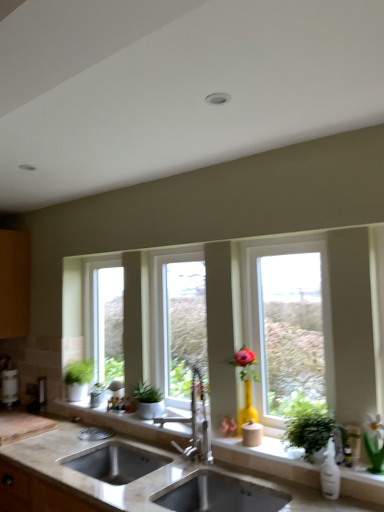
How much space does clear glass window at center, positioned as the 1th window in left-to-right order, occupy vertically?

The height of clear glass window at center, positioned as the 1th window in left-to-right order, is 39.18 inches.

This screenshot has width=384, height=512. What do you see at coordinates (104, 320) in the screenshot?
I see `clear glass window at center, which appears as the 3th window when viewed from the right` at bounding box center [104, 320].

Where is `marble/granite countertop at center`? This screenshot has width=384, height=512. marble/granite countertop at center is located at coordinates (79, 474).

Locate an element on the screen. clear glass window at center, placed as the 2th window when sorted from back to front is located at coordinates (183, 328).

Measure the distance between matte gray sink at center and camera.

1.71 meters.

Find the location of a particular element. This screenshot has height=512, width=384. clear glass window at center, which is the 1th window from back to front is located at coordinates (104, 320).

Is clear glass window at center, which is the second window from left to right, looking in the opposite direction of green matte houseplant at lower left, the first houseplant viewed from the back?

That's not correct — clear glass window at center, which is the second window from left to right, is not looking away from green matte houseplant at lower left, the first houseplant viewed from the back.

Is clear glass window at center, the 2th window from the front, far from green matte houseplant at lower left, the second houseplant viewed from the left?

That's not correct — clear glass window at center, the 2th window from the front, is a little close to green matte houseplant at lower left, the second houseplant viewed from the left.

From a real-world perspective, who is located lower, clear glass window at center, placed as the 2th window when sorted from back to front, or green matte houseplant at lower left, the second houseplant viewed from the left?

In real-world perspective, green matte houseplant at lower left, the second houseplant viewed from the left, is lower.

Based on the photo, can you confirm if clear glass window at center, marked as the 2th window in a right-to-left arrangement, is wider than green matte houseplant at lower left, the second houseplant viewed from the left?

Correct, the width of clear glass window at center, marked as the 2th window in a right-to-left arrangement, exceeds that of green matte houseplant at lower left, the second houseplant viewed from the left.

Which is in front, point (194, 435) or point (257, 484)?

Positioned in front is point (257, 484).

Which of these two, satin nickel faucet at center or matte gray sink at center, stands taller?

satin nickel faucet at center.

Is satin nickel faucet at center facing away from matte gray sink at center?

No, satin nickel faucet at center is not facing away from matte gray sink at center.

From the image's perspective, between satin nickel faucet at center and matte gray sink at center, who is located below?

matte gray sink at center, from the image's perspective.

From the image's perspective, would you say green matte plant at center, positioned as the second houseplant in front-to-back order, is positioned over clear glass window at center, the 3th window viewed from the back?

No, from the image's perspective, green matte plant at center, positioned as the second houseplant in front-to-back order, is not above clear glass window at center, the 3th window viewed from the back.

The image size is (384, 512). Find the location of `window that is the 2nd object to the right of the green matte plant at center, placed as the 2th houseplant when sorted from right to left, starting at the anchor`. window that is the 2nd object to the right of the green matte plant at center, placed as the 2th houseplant when sorted from right to left, starting at the anchor is located at coordinates (289, 325).

Measure the distance from green matte plant at center, the third houseplant in the back-to-front sequence, to clear glass window at center, the first window positioned from the right.

green matte plant at center, the third houseplant in the back-to-front sequence, and clear glass window at center, the first window positioned from the right, are 33.39 inches apart from each other.

From the picture: Is green matte plant at center, positioned as the 3th houseplant in left-to-right order, far from clear glass window at center, the 3th window viewed from the back?

No, green matte plant at center, positioned as the 3th houseplant in left-to-right order, is not far from clear glass window at center, the 3th window viewed from the back.

From the image's perspective, which one is positioned lower, matte wood cabinet at left or matte gray sink at center?

matte gray sink at center is shown below in the image.

Is matte wood cabinet at left turned away from matte gray sink at center?

No, matte wood cabinet at left is not facing the opposite direction of matte gray sink at center.

Is matte wood cabinet at left positioned before matte gray sink at center?

No, matte wood cabinet at left is further to the viewer.

Which is behind, point (29, 298) or point (131, 457)?

The point (29, 298) is behind.

Is matte wood cabinet at left positioned far away from green matte plant at left, the third houseplant in the front-to-back sequence?

No.

Is matte wood cabinet at left in front of green matte plant at left, the third houseplant in the front-to-back sequence?

No, matte wood cabinet at left is further to the viewer.

From the picture: Is matte wood cabinet at left not inside green matte plant at left, which is the 2th houseplant in back-to-front order?

Indeed, matte wood cabinet at left is completely outside green matte plant at left, which is the 2th houseplant in back-to-front order.

Is clear glass window at center, the 2th window from the front, taller than green matte flowerpot at left?

Yes, clear glass window at center, the 2th window from the front, is taller than green matte flowerpot at left.

Between clear glass window at center, placed as the 2th window when sorted from back to front, and green matte flowerpot at left, which one has smaller size?

With smaller size is green matte flowerpot at left.

Does clear glass window at center, placed as the 2th window when sorted from back to front, touch green matte flowerpot at left?

clear glass window at center, placed as the 2th window when sorted from back to front, and green matte flowerpot at left are clearly separated.

Is clear glass window at center, the 2th window from the front, aimed at green matte flowerpot at left?

No.

Considering the points (93, 399) and (82, 396), which point is in front, point (93, 399) or point (82, 396)?

The point (93, 399) is more forward.

Based on the photo, considering the sizes of green matte houseplant at lower left, the fourth houseplant from the front, and green matte plant at left, placed as the 1th houseplant when sorted from left to right, in the image, is green matte houseplant at lower left, the fourth houseplant from the front, bigger or smaller than green matte plant at left, placed as the 1th houseplant when sorted from left to right,?

Clearly, green matte houseplant at lower left, the fourth houseplant from the front, is smaller in size than green matte plant at left, placed as the 1th houseplant when sorted from left to right.

Considering the positions of objects green matte houseplant at lower left, the fourth houseplant from the front, and green matte plant at left, the 4th houseplant positioned from the right, in the image provided, who is behind, green matte houseplant at lower left, the fourth houseplant from the front, or green matte plant at left, the 4th houseplant positioned from the right,?

green matte houseplant at lower left, the fourth houseplant from the front, is further from the camera.

From a real-world perspective, which object rests below the other?

From a 3D spatial view, green matte houseplant at lower left, the second houseplant viewed from the left, is below.

Locate an element on the screen. This screenshot has width=384, height=512. houseplant that is the 3rd one when counting backward from the clear glass window at center, marked as the 2th window in a right-to-left arrangement is located at coordinates (99, 394).

The image size is (384, 512). I want to click on sink lying below the satin nickel faucet at center (from the image's perspective), so click(217, 493).

Looking at this image, considering their positions, is matte gray sink at center positioned closer to green matte plant at center, positioned as the 3th houseplant in left-to-right order, than satin nickel faucet at center?

satin nickel faucet at center is positioned closer to the anchor green matte plant at center, positioned as the 3th houseplant in left-to-right order.

Estimate the real-world distances between objects in this image. Which object is further from clear glass window at center, the 2th window from the front, green leafy plant at right, which is counted as the first houseplant, starting from the right, or green matte plant at center, positioned as the second houseplant in front-to-back order?

Among the two, green leafy plant at right, which is counted as the first houseplant, starting from the right, is located further to clear glass window at center, the 2th window from the front.

Based on the photo, which object lies further to the anchor point green matte houseplant at lower left, which is counted as the third houseplant, starting from the right, matte gray sink at center or satin nickel faucet at center?

matte gray sink at center.

Which object lies nearer to the anchor point marble/granite countertop at center, green matte plant at left, placed as the 1th houseplant when sorted from left to right, or satin nickel faucet at center?

satin nickel faucet at center lies closer to marble/granite countertop at center than the other object.

Looking at this image, estimate the real-world distances between objects in this image. Which object is closer to matte gray sink at center, green matte plant at center, positioned as the second houseplant in front-to-back order, or green leafy plant at right, the fourth houseplant viewed from the left?

Among the two, green matte plant at center, positioned as the second houseplant in front-to-back order, is located nearer to matte gray sink at center.

Which object lies nearer to the anchor point green matte plant at center, positioned as the 3th houseplant in left-to-right order, matte gray sink at center or matte wood cabinet at left?

matte gray sink at center is positioned closer to the anchor green matte plant at center, positioned as the 3th houseplant in left-to-right order.

Estimate the real-world distances between objects in this image. Which object is closer to green matte plant at center, the third houseplant in the back-to-front sequence, marble/granite countertop at center or green matte plant at left, the 4th houseplant positioned from the right?

marble/granite countertop at center lies closer to green matte plant at center, the third houseplant in the back-to-front sequence, than the other object.

From the image, which object appears to be farther from green leafy plant at right, placed as the fourth houseplant when sorted from back to front, matte gray sink at center or clear glass window at center, marked as the 2th window in a right-to-left arrangement?

clear glass window at center, marked as the 2th window in a right-to-left arrangement.

You are a GUI agent. You are given a task and a screenshot of the screen. Output one action in this format:
    pyautogui.click(x=<x>, y=<y>)
    Task: Click on the sink between marble/granite countertop at center and matte wood cabinet at left from front to back
    This screenshot has height=512, width=384.
    Given the screenshot: What is the action you would take?
    pyautogui.click(x=217, y=493)

Locate an element on the screen. The height and width of the screenshot is (512, 384). tap between marble/granite countertop at center and green leafy plant at right, placed as the fourth houseplant when sorted from back to front is located at coordinates (194, 423).

Where is `sink situated between matte wood cabinet at left and green leafy plant at right, which is counted as the first houseplant, starting from the right, from left to right`? The image size is (384, 512). sink situated between matte wood cabinet at left and green leafy plant at right, which is counted as the first houseplant, starting from the right, from left to right is located at coordinates (217, 493).

Locate an element on the screen. countertop located between matte wood cabinet at left and green leafy plant at right, which ranks as the first houseplant in front-to-back order, in the left-right direction is located at coordinates (79, 474).